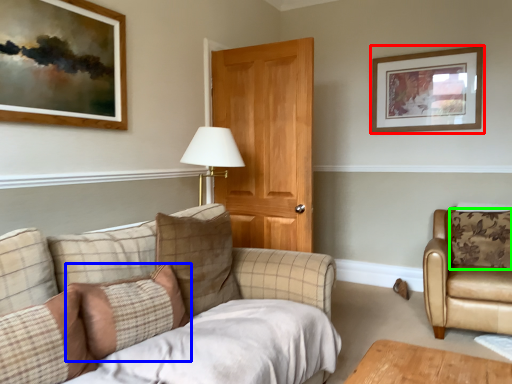
Question: Which object is positioned closest to picture frame (highlighted by a red box)? Select from pillow (highlighted by a blue box) and pillow (highlighted by a green box).

Choices:
 (A) pillow
 (B) pillow

Answer: (B)